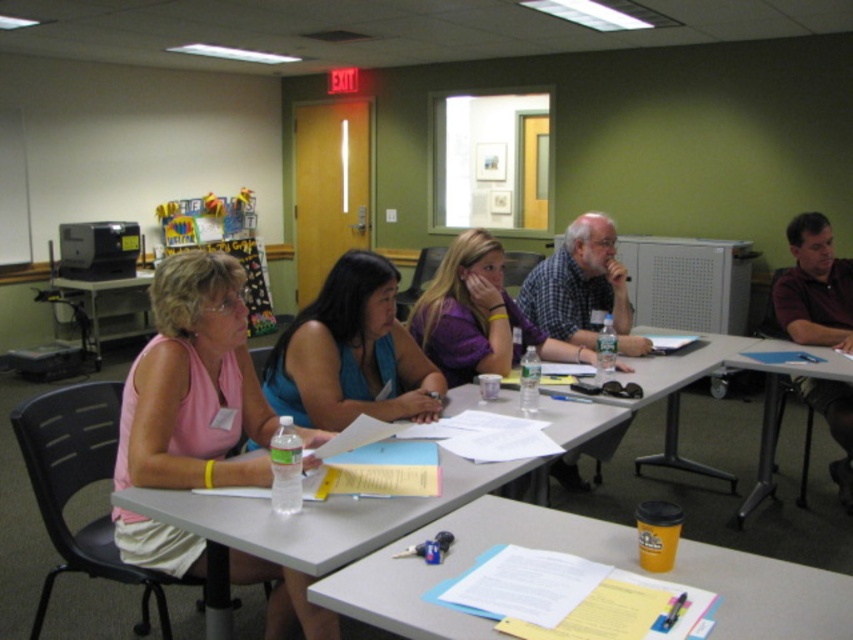
Which is behind, point (549, 432) or point (782, 330)?

Positioned behind is point (782, 330).

Who is positioned more to the left, gray plastic table at center or dark brown shirt at right?

Positioned to the left is gray plastic table at center.

Where is `gray plastic table at center`? This screenshot has width=853, height=640. gray plastic table at center is located at coordinates (317, 522).

Between white paper at center and matte plastic table at center, which one has more height?

matte plastic table at center

Is point (445, 525) closer to camera compared to point (109, 340)?

Yes, it is.

Between point (457, 566) and point (114, 342), which one is positioned behind?

Point (114, 342)

Find the location of a particular element. This screenshot has width=853, height=640. white paper at center is located at coordinates (463, 564).

Who is shorter, white paper at center or white matte bulletin board at upper left?

white paper at center is shorter.

Describe the element at coordinates (463, 564) in the screenshot. The image size is (853, 640). I see `white paper at center` at that location.

Locate an element on the screen. The width and height of the screenshot is (853, 640). white paper at center is located at coordinates (463, 564).